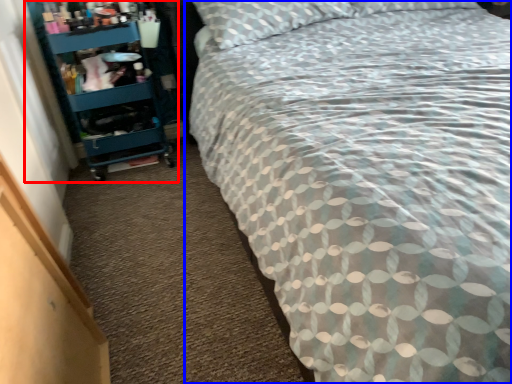
Question: Among these objects, which one is farthest to the camera, shelf (highlighted by a red box) or bed (highlighted by a blue box)?

Choices:
 (A) shelf
 (B) bed

Answer: (A)